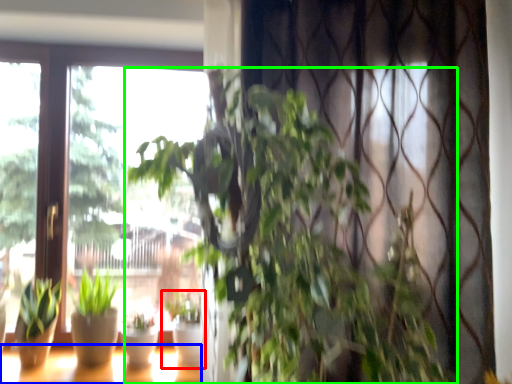
Question: Which is nearer to the houseplant (highlighted by a red box)? window (highlighted by a blue box) or houseplant (highlighted by a green box).

Choices:
 (A) window
 (B) houseplant

Answer: (A)